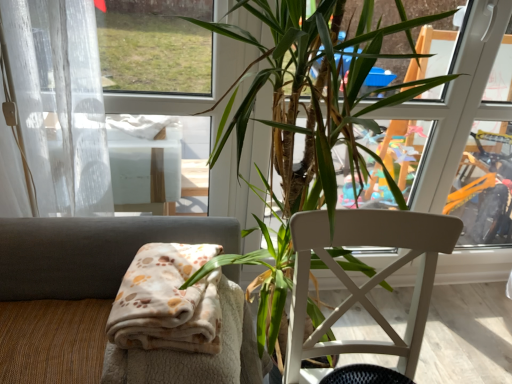
Question: Considering the relative positions of white wood chair at center, which is counted as the first chair, starting from the right, and green leafy plant at center in the image provided, is white wood chair at center, which is counted as the first chair, starting from the right, to the left of green leafy plant at center from the viewer's perspective?

Choices:
 (A) no
 (B) yes

Answer: (A)

Question: Are white wood chair at center, which is counted as the first chair, starting from the right, and green leafy plant at center making contact?

Choices:
 (A) no
 (B) yes

Answer: (A)

Question: Is white wood chair at center, which is counted as the first chair, starting from the right, behind green leafy plant at center?

Choices:
 (A) yes
 (B) no

Answer: (A)

Question: Can you confirm if white wood chair at center, which appears as the second chair when viewed from the left, is positioned to the right of green leafy plant at center?

Choices:
 (A) no
 (B) yes

Answer: (B)

Question: From the image's perspective, is white wood chair at center, which appears as the second chair when viewed from the left, beneath green leafy plant at center?

Choices:
 (A) yes
 (B) no

Answer: (A)

Question: From the image's perspective, would you say white wood chair at center, which appears as the second chair when viewed from the left, is positioned over green leafy plant at center?

Choices:
 (A) yes
 (B) no

Answer: (B)

Question: Is white wood chair at center, which appears as the second chair when viewed from the left, turned away from white sheer curtain at left?

Choices:
 (A) yes
 (B) no

Answer: (B)

Question: Is white wood chair at center, which appears as the second chair when viewed from the left, bigger than white sheer curtain at left?

Choices:
 (A) yes
 (B) no

Answer: (A)

Question: Is white sheer curtain at left inside white wood chair at center, which is counted as the first chair, starting from the right?

Choices:
 (A) no
 (B) yes

Answer: (A)

Question: Is white wood chair at center, which appears as the second chair when viewed from the left, in front of white sheer curtain at left?

Choices:
 (A) yes
 (B) no

Answer: (A)

Question: Is white wood chair at center, which appears as the second chair when viewed from the left, wider than white sheer curtain at left?

Choices:
 (A) yes
 (B) no

Answer: (A)

Question: From a real-world perspective, is white wood chair at center, which appears as the second chair when viewed from the left, over white sheer curtain at left?

Choices:
 (A) no
 (B) yes

Answer: (A)

Question: Is beige fabric chair at lower left, the 1th chair viewed from the left, shorter than green leafy plant at center?

Choices:
 (A) yes
 (B) no

Answer: (A)